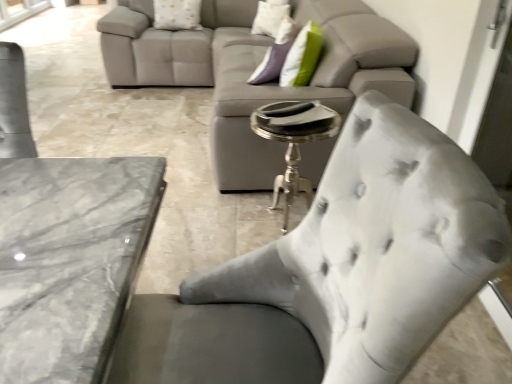
Locate an element on the screen. The height and width of the screenshot is (384, 512). white textured pillow at upper center, arranged as the 1th pillow when viewed from the right is located at coordinates (270, 17).

Describe the element at coordinates (177, 14) in the screenshot. I see `white textured pillow at upper center, the first pillow from the left` at that location.

Where is `satin gray chair at lower right`? Image resolution: width=512 pixels, height=384 pixels. satin gray chair at lower right is located at coordinates (419, 234).

How different are the orientations of white textured pillow at upper center, the first pillow from the left, and satin gray chair at lower right in degrees?

84.2 degrees separate the facing orientations of white textured pillow at upper center, the first pillow from the left, and satin gray chair at lower right.

Between white textured pillow at upper center, the first pillow from the left, and satin gray chair at lower right, which one appears on the left side from the viewer's perspective?

white textured pillow at upper center, the first pillow from the left, is more to the left.

From the image's perspective, is white textured pillow at upper center, the first pillow from the left, above or below satin gray chair at lower right?

white textured pillow at upper center, the first pillow from the left, is situated higher than satin gray chair at lower right in the image.

Does white textured pillow at upper center, the first pillow from the left, have a lesser width compared to satin gray chair at lower right?

Correct, the width of white textured pillow at upper center, the first pillow from the left, is less than that of satin gray chair at lower right.

You are a GUI agent. You are given a task and a screenshot of the screen. Output one action in this format:
    pyautogui.click(x=<x>, y=<y>)
    Task: Click on the pillow in front of the white textured pillow at upper center, the first pillow from the left
    Image resolution: width=512 pixels, height=384 pixels.
    Given the screenshot: What is the action you would take?
    270,17

Is white textured pillow at upper center, the 2th pillow in the right-to-left sequence, inside the boundaries of white textured pillow at upper center, the second pillow when ordered from left to right, or outside?

The correct answer is: outside.

Is white textured pillow at upper center, the 2th pillow in the right-to-left sequence, touching white textured pillow at upper center, arranged as the 1th pillow when viewed from the right?

No, white textured pillow at upper center, the 2th pillow in the right-to-left sequence, is not in contact with white textured pillow at upper center, arranged as the 1th pillow when viewed from the right.

From the image's perspective, which one is positioned lower, white textured pillow at upper center, the 2th pillow in the right-to-left sequence, or white textured pillow at upper center, the second pillow when ordered from left to right?

white textured pillow at upper center, the 2th pillow in the right-to-left sequence, appears lower in the image.

From the image's perspective, is silver metallic side table at center located above or below white textured pillow at upper center, the second pillow when ordered from left to right?

Based on their image positions, silver metallic side table at center is located beneath white textured pillow at upper center, the second pillow when ordered from left to right.

Is silver metallic side table at center closer to camera compared to white textured pillow at upper center, arranged as the 1th pillow when viewed from the right?

Yes.

How far apart are silver metallic side table at center and white textured pillow at upper center, arranged as the 1th pillow when viewed from the right?

A distance of 6.15 feet exists between silver metallic side table at center and white textured pillow at upper center, arranged as the 1th pillow when viewed from the right.

Considering the relative sizes of silver metallic side table at center and white textured pillow at upper center, arranged as the 1th pillow when viewed from the right, in the image provided, is silver metallic side table at center bigger than white textured pillow at upper center, arranged as the 1th pillow when viewed from the right,?

Yes, silver metallic side table at center is bigger than white textured pillow at upper center, arranged as the 1th pillow when viewed from the right.

Are white textured pillow at upper center, the 2th pillow in the right-to-left sequence, and silver metallic side table at center far apart?

Indeed, white textured pillow at upper center, the 2th pillow in the right-to-left sequence, is not near silver metallic side table at center.

From the image's perspective, between white textured pillow at upper center, the first pillow from the left, and silver metallic side table at center, who is located below?

silver metallic side table at center is shown below in the image.

In the scene shown: From a real-world perspective, which object stands above the other?

white textured pillow at upper center, the 2th pillow in the right-to-left sequence.

Could you tell me if satin gray chair at lower right is turned towards white textured pillow at upper center, the second pillow when ordered from left to right?

No, satin gray chair at lower right is not oriented towards white textured pillow at upper center, the second pillow when ordered from left to right.

Is satin gray chair at lower right positioned in front of white textured pillow at upper center, the second pillow when ordered from left to right?

Yes, satin gray chair at lower right is closer to the viewer.

Are satin gray chair at lower right and white textured pillow at upper center, the second pillow when ordered from left to right, making contact?

satin gray chair at lower right is not next to white textured pillow at upper center, the second pillow when ordered from left to right, and they're not touching.

How different are the orientations of satin gray chair at lower right and white textured pillow at upper center, arranged as the 1th pillow when viewed from the right, in degrees?

The angular difference between satin gray chair at lower right and white textured pillow at upper center, arranged as the 1th pillow when viewed from the right, is 14.2 degrees.

Choose the correct answer: Is satin gray chair at lower right inside silver metallic side table at center or outside it?

satin gray chair at lower right is located beyond the bounds of silver metallic side table at center.

From a real-world perspective, relative to silver metallic side table at center, is satin gray chair at lower right vertically above or below?

Clearly, from a real-world perspective, satin gray chair at lower right is below silver metallic side table at center.

Find the location of a particular element. This screenshot has width=512, height=384. side table behind the satin gray chair at lower right is located at coordinates (294, 141).

Is white textured pillow at upper center, the second pillow when ordered from left to right, in front of or behind satin gray chair at lower right in the image?

white textured pillow at upper center, the second pillow when ordered from left to right, is behind satin gray chair at lower right.

From a real-world perspective, between white textured pillow at upper center, the second pillow when ordered from left to right, and satin gray chair at lower right, who is vertically higher?

In real-world perspective, white textured pillow at upper center, the second pillow when ordered from left to right, is above.

How different are the orientations of white textured pillow at upper center, arranged as the 1th pillow when viewed from the right, and satin gray chair at lower right in degrees?

The angle between the facing direction of white textured pillow at upper center, arranged as the 1th pillow when viewed from the right, and the facing direction of satin gray chair at lower right is 14.2 degrees.

Considering the points (283, 18) and (359, 126), which point is in front, point (283, 18) or point (359, 126)?

Positioned in front is point (359, 126).

You are a GUI agent. You are given a task and a screenshot of the screen. Output one action in this format:
    pyautogui.click(x=<x>, y=<y>)
    Task: Click on the 2nd pillow behind when counting from the satin gray chair at lower right
    Image resolution: width=512 pixels, height=384 pixels.
    Given the screenshot: What is the action you would take?
    pyautogui.click(x=177, y=14)

You are a GUI agent. You are given a task and a screenshot of the screen. Output one action in this format:
    pyautogui.click(x=<x>, y=<y>)
    Task: Click on the pillow that appears on the right of white textured pillow at upper center, the 2th pillow in the right-to-left sequence
    
    Given the screenshot: What is the action you would take?
    pyautogui.click(x=270, y=17)

From the image, which object appears to be nearer to silver metallic side table at center, white textured pillow at upper center, arranged as the 1th pillow when viewed from the right, or satin gray chair at lower right?

Among the two, satin gray chair at lower right is located nearer to silver metallic side table at center.

From the picture: Estimate the real-world distances between objects in this image. Which object is closer to silver metallic side table at center, white textured pillow at upper center, the 2th pillow in the right-to-left sequence, or satin gray chair at lower right?

Based on the image, satin gray chair at lower right appears to be nearer to silver metallic side table at center.

Based on their spatial positions, is satin gray chair at lower right or white textured pillow at upper center, the first pillow from the left, closer to silver metallic side table at center?

Based on the image, satin gray chair at lower right appears to be nearer to silver metallic side table at center.

From the image, which object appears to be farther from white textured pillow at upper center, the second pillow when ordered from left to right, silver metallic side table at center or white textured pillow at upper center, the first pillow from the left?

silver metallic side table at center is positioned further to the anchor white textured pillow at upper center, the second pillow when ordered from left to right.

Looking at the image, which one is located further to satin gray chair at lower right, silver metallic side table at center or white textured pillow at upper center, the 2th pillow in the right-to-left sequence?

white textured pillow at upper center, the 2th pillow in the right-to-left sequence.

When comparing their distances from white textured pillow at upper center, arranged as the 1th pillow when viewed from the right, does satin gray chair at lower right or silver metallic side table at center seem further?

satin gray chair at lower right lies further to white textured pillow at upper center, arranged as the 1th pillow when viewed from the right, than the other object.

Based on their spatial positions, is silver metallic side table at center or white textured pillow at upper center, arranged as the 1th pillow when viewed from the right, further from satin gray chair at lower right?

white textured pillow at upper center, arranged as the 1th pillow when viewed from the right, is further to satin gray chair at lower right.

Looking at the image, which one is located further to silver metallic side table at center, white textured pillow at upper center, the first pillow from the left, or white textured pillow at upper center, arranged as the 1th pillow when viewed from the right?

white textured pillow at upper center, the first pillow from the left, lies further to silver metallic side table at center than the other object.

This screenshot has width=512, height=384. What are the coordinates of `pillow positioned between silver metallic side table at center and white textured pillow at upper center, the 2th pillow in the right-to-left sequence, from near to far` in the screenshot? It's located at pyautogui.click(x=270, y=17).

Find the location of a particular element. pillow located between satin gray chair at lower right and white textured pillow at upper center, the 2th pillow in the right-to-left sequence, in the depth direction is located at coordinates (270, 17).

At what (x,y) coordinates should I click in order to perform the action: click on side table between satin gray chair at lower right and white textured pillow at upper center, arranged as the 1th pillow when viewed from the right, along the z-axis. Please return your answer as a coordinate pair (x, y). This screenshot has width=512, height=384. Looking at the image, I should click on (294, 141).

At what (x,y) coordinates should I click in order to perform the action: click on side table positioned between satin gray chair at lower right and white textured pillow at upper center, the 2th pillow in the right-to-left sequence, from near to far. Please return your answer as a coordinate pair (x, y). The height and width of the screenshot is (384, 512). Looking at the image, I should click on (294, 141).